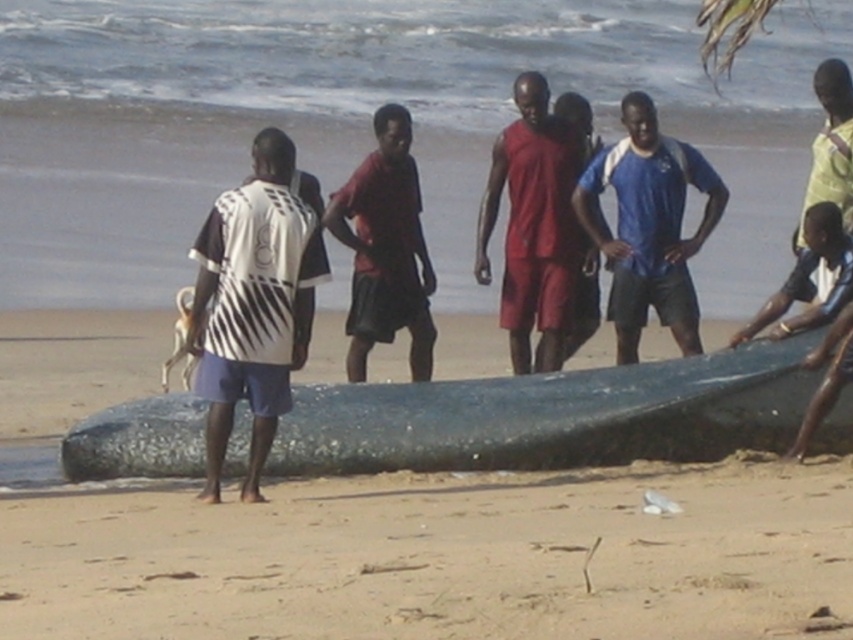
You are a photographer standing on the beach and want to take a photo of the shiny dark blue boat at center and the blue jersey at center. Which object should you focus on first if you want to capture both in the same frame without moving the camera?

The shiny dark blue boat at center is positioned under the blue jersey at center, so you should focus on the shiny dark blue boat at center first to ensure both are in focus since it is closer to the camera.

You are standing on the beach and see the shiny dark blue boat at center and the white striped shirt at center. Which object is wider?

The shiny dark blue boat at center is wider than the white striped shirt at center.